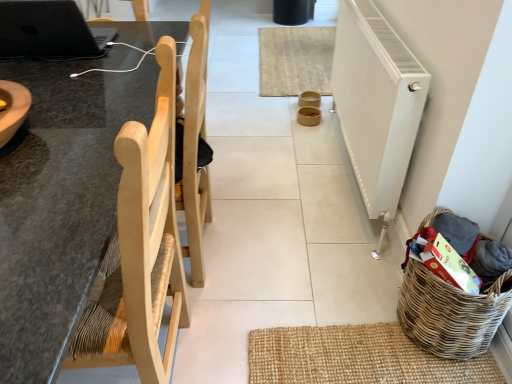
At what (x,y) coordinates should I click in order to perform the action: click on natural wood chair at left. Please return your answer as a coordinate pair (x, y). This screenshot has width=512, height=384. Looking at the image, I should click on (139, 250).

What do you see at coordinates (449, 313) in the screenshot? The image size is (512, 384). I see `woven brown basket at lower right` at bounding box center [449, 313].

Find the location of a particular element. natural wood chair at left is located at coordinates (139, 250).

In the scene shown: Is black matte laptop at upper left closer to camera compared to white textured radiator at right?

Yes, black matte laptop at upper left is closer to the camera.

Does point (32, 18) come in front of point (377, 54)?

Yes.

Do you think black matte laptop at upper left is within white textured radiator at right, or outside of it?

black matte laptop at upper left is not inside white textured radiator at right, it's outside.

From the picture: From the image's perspective, which is below, black matte laptop at upper left or white textured radiator at right?

white textured radiator at right appears lower in the image.

Consider the image. Considering the sizes of objects white textured radiator at right and natural fiber mat at center in the image provided, who is smaller, white textured radiator at right or natural fiber mat at center?

natural fiber mat at center is smaller.

In the scene shown: Is white textured radiator at right oriented towards natural fiber mat at center?

No, white textured radiator at right is not aimed at natural fiber mat at center.

Would you say white textured radiator at right is inside or outside natural fiber mat at center?

white textured radiator at right exists outside the volume of natural fiber mat at center.

Considering the relative positions of white textured radiator at right and natural fiber mat at center in the image provided, is white textured radiator at right to the right of natural fiber mat at center from the viewer's perspective?

Yes, white textured radiator at right is to the right of natural fiber mat at center.

Is natural fiber mat at center to the left of black matte laptop at upper left from the viewer's perspective?

Incorrect, natural fiber mat at center is not on the left side of black matte laptop at upper left.

Which of these two, natural fiber mat at center or black matte laptop at upper left, is wider?

Wider between the two is natural fiber mat at center.

Is natural fiber mat at center spatially inside black matte laptop at upper left, or outside of it?

natural fiber mat at center cannot be found inside black matte laptop at upper left.

Does point (272, 68) come closer to viewer compared to point (44, 58)?

That is False.

Between natural wood chair at left and woven brown basket at lower right, which one is positioned in front?

natural wood chair at left.

Is point (119, 363) farther from viewer compared to point (402, 310)?

No, it is in front of (402, 310).

Is natural wood chair at left smaller than woven brown basket at lower right?

No, natural wood chair at left is not smaller than woven brown basket at lower right.

From a real-world perspective, which is physically below, natural wood chair at left or woven brown basket at lower right?

woven brown basket at lower right.

Is black matte laptop at upper left placed right next to natural fiber mat at center?

No, black matte laptop at upper left is not next to natural fiber mat at center.

Is natural fiber mat at center inside black matte laptop at upper left?

No, black matte laptop at upper left does not contain natural fiber mat at center.

Is black matte laptop at upper left facing towards natural fiber mat at center?

No, black matte laptop at upper left is not turned towards natural fiber mat at center.

From the image's perspective, between black matte laptop at upper left and natural fiber mat at center, who is located below?

black matte laptop at upper left appears lower in the image.

Is black matte laptop at upper left shorter than woven brown basket at lower right?

Correct, black matte laptop at upper left is not as tall as woven brown basket at lower right.

From a real-world perspective, does black matte laptop at upper left sit lower than woven brown basket at lower right?

Actually, black matte laptop at upper left is physically above woven brown basket at lower right in the real world.

Is point (30, 33) positioned in front of point (499, 280)?

No, it is not.

From the image's perspective, would you say black matte laptop at upper left is shown under woven brown basket at lower right?

Actually, black matte laptop at upper left appears above woven brown basket at lower right in the image.

Which is more to the right, woven brown basket at lower right or black matte laptop at upper left?

woven brown basket at lower right is more to the right.

This screenshot has height=384, width=512. I want to click on basket that is on the right side of black matte laptop at upper left, so click(x=449, y=313).

Can you tell me how much woven brown basket at lower right and black matte laptop at upper left differ in facing direction?

woven brown basket at lower right and black matte laptop at upper left are facing 88.6 degrees away from each other.

Is woven brown basket at lower right turned away from black matte laptop at upper left?

No, black matte laptop at upper left is not at the back of woven brown basket at lower right.

At what (x,y) coordinates should I click in order to perform the action: click on laptop lying above the white textured radiator at right (from the image's perspective). Please return your answer as a coordinate pair (x, y). Looking at the image, I should click on (49, 31).

Find the location of a particular element. radiator on the right of natural fiber mat at center is located at coordinates (376, 104).

Estimate the real-world distances between objects in this image. Which object is closer to white textured radiator at right, natural wood chair at left or black matte laptop at upper left?

The object closer to white textured radiator at right is natural wood chair at left.

Looking at the image, which one is located closer to white textured radiator at right, woven brown basket at lower right or black matte laptop at upper left?

The object closer to white textured radiator at right is woven brown basket at lower right.

Estimate the real-world distances between objects in this image. Which object is further from white textured radiator at right, black matte laptop at upper left or natural fiber mat at center?

Based on the image, black matte laptop at upper left appears to be further to white textured radiator at right.

Considering their positions, is black matte laptop at upper left positioned further to natural wood chair at left than woven brown basket at lower right?

Result: woven brown basket at lower right.

Looking at the image, which one is located closer to woven brown basket at lower right, natural fiber mat at center or natural wood chair at left?

Based on the image, natural wood chair at left appears to be nearer to woven brown basket at lower right.

Which object lies nearer to the anchor point white textured radiator at right, natural fiber mat at center or natural wood chair at left?

Based on the image, natural wood chair at left appears to be nearer to white textured radiator at right.

Considering their positions, is woven brown basket at lower right positioned further to natural wood chair at left than black matte laptop at upper left?

Based on the image, woven brown basket at lower right appears to be further to natural wood chair at left.

Based on their spatial positions, is natural fiber mat at center or black matte laptop at upper left further from natural wood chair at left?

natural fiber mat at center is further to natural wood chair at left.

Locate an element on the screen. chair situated between black matte laptop at upper left and woven brown basket at lower right from left to right is located at coordinates (139, 250).

Identify the location of radiator between natural wood chair at left and natural fiber mat at center in the front-back direction. (376, 104).

Identify the location of radiator between natural wood chair at left and woven brown basket at lower right. (376, 104).

Locate an element on the screen. radiator located between black matte laptop at upper left and natural fiber mat at center in the depth direction is located at coordinates (376, 104).